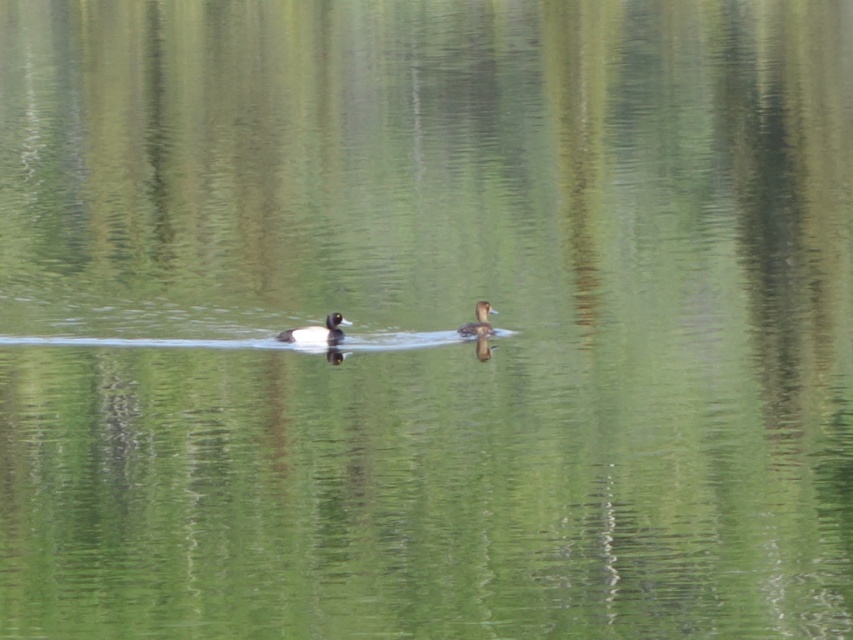
Does brown matte duck at center appear on the right side of brown fuzzy duck at center?

Incorrect, brown matte duck at center is not on the right side of brown fuzzy duck at center.

Is point (331, 312) less distant than point (460, 332)?

Yes, point (331, 312) is in front of point (460, 332).

Find the location of a particular element. This screenshot has height=640, width=853. brown matte duck at center is located at coordinates (316, 332).

Find the location of `brown matte duck at center`. brown matte duck at center is located at coordinates (316, 332).